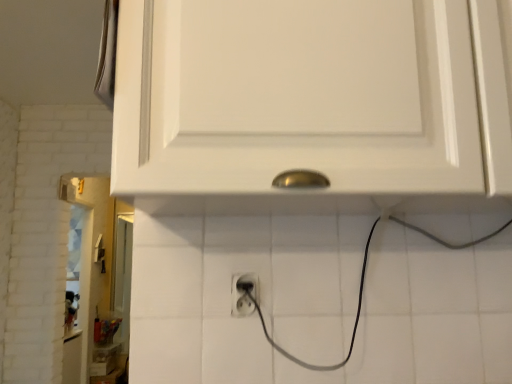
Question: From the image's perspective, is white matte cabinet at upper center above black plastic power plugs and sockets at center?

Choices:
 (A) no
 (B) yes

Answer: (B)

Question: Is the depth of white matte cabinet at upper center greater than that of black plastic power plugs and sockets at center?

Choices:
 (A) no
 (B) yes

Answer: (A)

Question: Does white matte cabinet at upper center appear on the right side of black plastic power plugs and sockets at center?

Choices:
 (A) no
 (B) yes

Answer: (B)

Question: Is white matte cabinet at upper center closer to the viewer compared to black plastic power plugs and sockets at center?

Choices:
 (A) no
 (B) yes

Answer: (B)

Question: From a real-world perspective, is white matte cabinet at upper center positioned under black plastic power plugs and sockets at center based on gravity?

Choices:
 (A) no
 (B) yes

Answer: (A)

Question: Does white matte cabinet at upper center have a lesser height compared to black plastic power plugs and sockets at center?

Choices:
 (A) no
 (B) yes

Answer: (A)

Question: From the image's perspective, would you say black plastic power plugs and sockets at center is positioned over white matte cabinet at upper center?

Choices:
 (A) no
 (B) yes

Answer: (A)

Question: Is black plastic power plugs and sockets at center shorter than white matte cabinet at upper center?

Choices:
 (A) no
 (B) yes

Answer: (B)

Question: Is black plastic power plugs and sockets at center positioned far away from white matte cabinet at upper center?

Choices:
 (A) no
 (B) yes

Answer: (A)

Question: From a real-world perspective, is black plastic power plugs and sockets at center beneath white matte cabinet at upper center?

Choices:
 (A) no
 (B) yes

Answer: (B)

Question: Considering the relative sizes of black plastic power plugs and sockets at center and white matte cabinet at upper center in the image provided, is black plastic power plugs and sockets at center wider than white matte cabinet at upper center?

Choices:
 (A) no
 (B) yes

Answer: (A)

Question: Considering the relative sizes of black plastic power plugs and sockets at center and white matte cabinet at upper center in the image provided, is black plastic power plugs and sockets at center smaller than white matte cabinet at upper center?

Choices:
 (A) yes
 (B) no

Answer: (A)

Question: From a real-world perspective, is black plastic power plugs and sockets at center physically located above or below white matte cabinet at upper center?

Choices:
 (A) below
 (B) above

Answer: (A)